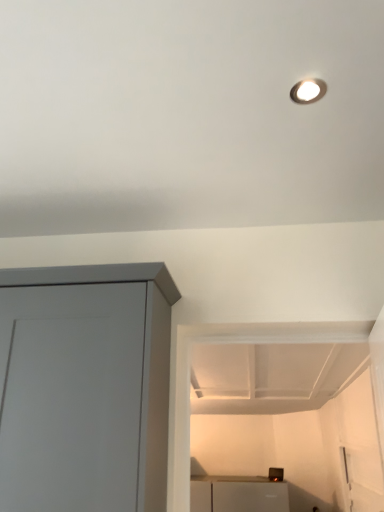
Measure the distance between metallic silver toaster at lower center and camera.

metallic silver toaster at lower center is 3.47 meters away from camera.

Describe the element at coordinates (276, 474) in the screenshot. The image size is (384, 512). I see `metallic silver toaster at lower center` at that location.

The height and width of the screenshot is (512, 384). In order to click on metallic silver toaster at lower center in this screenshot , I will do `click(276, 474)`.

Find the location of a particular element. The height and width of the screenshot is (512, 384). matte gray cupboard at left is located at coordinates tap(85, 387).

This screenshot has width=384, height=512. Describe the element at coordinates (85, 387) in the screenshot. I see `matte gray cupboard at left` at that location.

Where is `metallic silver toaster at lower center`? This screenshot has width=384, height=512. metallic silver toaster at lower center is located at coordinates (276, 474).

Visually, is matte gray cupboard at left positioned to the left or to the right of metallic silver toaster at lower center?

matte gray cupboard at left is to the left of metallic silver toaster at lower center.

Which is behind, matte gray cupboard at left or metallic silver toaster at lower center?

metallic silver toaster at lower center is further from the camera.

Between point (82, 442) and point (276, 477), which one is positioned behind?

The point (276, 477) is more distant.

From the image's perspective, which one is positioned higher, matte gray cupboard at left or metallic silver toaster at lower center?

matte gray cupboard at left.

From a real-world perspective, is matte gray cupboard at left positioned above or below metallic silver toaster at lower center?

In terms of real-world spatial position, matte gray cupboard at left is above metallic silver toaster at lower center.

Between matte gray cupboard at left and metallic silver toaster at lower center, which one has smaller width?

metallic silver toaster at lower center is thinner.

In terms of height, does matte gray cupboard at left look taller or shorter compared to metallic silver toaster at lower center?

Considering their sizes, matte gray cupboard at left has more height than metallic silver toaster at lower center.

Is matte gray cupboard at left smaller than metallic silver toaster at lower center?

Actually, matte gray cupboard at left might be larger than metallic silver toaster at lower center.

Does matte gray cupboard at left contain metallic silver toaster at lower center?

No, metallic silver toaster at lower center is not a part of matte gray cupboard at left.

Based on the photo, would you consider matte gray cupboard at left to be distant from metallic silver toaster at lower center?

Yes, matte gray cupboard at left and metallic silver toaster at lower center are located far from each other.

Is matte gray cupboard at left looking in the opposite direction of metallic silver toaster at lower center?

Correct, matte gray cupboard at left is looking away from metallic silver toaster at lower center.

Can you tell me how much matte gray cupboard at left and metallic silver toaster at lower center differ in facing direction?

There is a 0.6-degree angle between the facing directions of matte gray cupboard at left and metallic silver toaster at lower center.

How much distance is there between matte gray cupboard at left and metallic silver toaster at lower center?

matte gray cupboard at left and metallic silver toaster at lower center are 2.90 meters apart from each other.

Image resolution: width=384 pixels, height=512 pixels. In order to click on appliance below the matte gray cupboard at left (from the image's perspective) in this screenshot , I will do `click(276, 474)`.

Based on their positions, is metallic silver toaster at lower center located to the left or right of matte gray cupboard at left?

In the image, metallic silver toaster at lower center appears on the right side of matte gray cupboard at left.

Is metallic silver toaster at lower center positioned in front of matte gray cupboard at left?

No.

Between point (282, 478) and point (127, 490), which one is positioned in front?

Point (127, 490)

From the image's perspective, is metallic silver toaster at lower center located above or below matte gray cupboard at left?

metallic silver toaster at lower center is situated lower than matte gray cupboard at left in the image.

From a real-world perspective, is metallic silver toaster at lower center positioned above or below matte gray cupboard at left?

metallic silver toaster at lower center is below matte gray cupboard at left.

Which of these two, metallic silver toaster at lower center or matte gray cupboard at left, is thinner?

metallic silver toaster at lower center.

In terms of height, does metallic silver toaster at lower center look taller or shorter compared to matte gray cupboard at left?

metallic silver toaster at lower center is shorter than matte gray cupboard at left.

Does metallic silver toaster at lower center have a larger size compared to matte gray cupboard at left?

No.

Would you say metallic silver toaster at lower center is inside or outside matte gray cupboard at left?

metallic silver toaster at lower center lies outside matte gray cupboard at left.

Would you consider metallic silver toaster at lower center to be distant from matte gray cupboard at left?

Yes, metallic silver toaster at lower center and matte gray cupboard at left are located far from each other.

Is metallic silver toaster at lower center facing towards matte gray cupboard at left?

Yes, metallic silver toaster at lower center is turned towards matte gray cupboard at left.

How far apart are metallic silver toaster at lower center and matte gray cupboard at left?

A distance of 2.90 meters exists between metallic silver toaster at lower center and matte gray cupboard at left.

Find the location of `appliance that is under the matte gray cupboard at left (from a real-world perspective)`. appliance that is under the matte gray cupboard at left (from a real-world perspective) is located at coordinates (276, 474).

The width and height of the screenshot is (384, 512). I want to click on appliance on the right side of matte gray cupboard at left, so click(276, 474).

Locate an element on the screen. cupboard that appears in front of the metallic silver toaster at lower center is located at coordinates (85, 387).